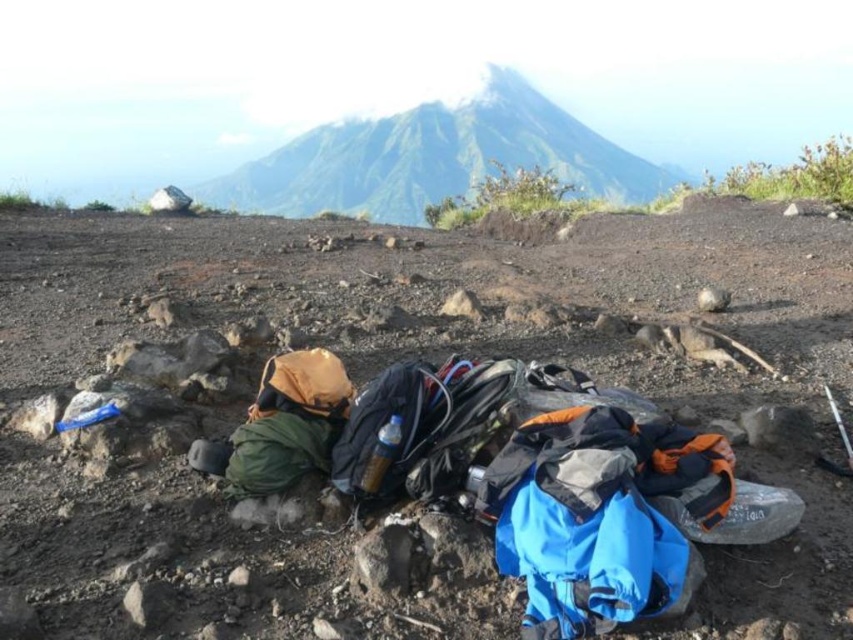
You are a hiker trying to navigate through the rocky terrain. You see a dull gray rock at center and a smooth gray mountain at upper center. Which object is closer to you?

The dull gray rock at center is closer to you because it is located in the foreground compared to the smooth gray mountain at upper center, which is in the background.

You are a hiker planning to place a 1.5 meter wide tent between the dull gray rock at center and the smooth gray mountain at upper center. Considering their widths, will there be enough space for the tent?

The dull gray rock at center has a lesser width compared to smooth gray mountain at upper center, but the question is about placing a tent between them. However, the description only provides information about their widths relative to each other, not the distance between them. Therefore, we cannot determine if there is enough space for the tent based on the given information.